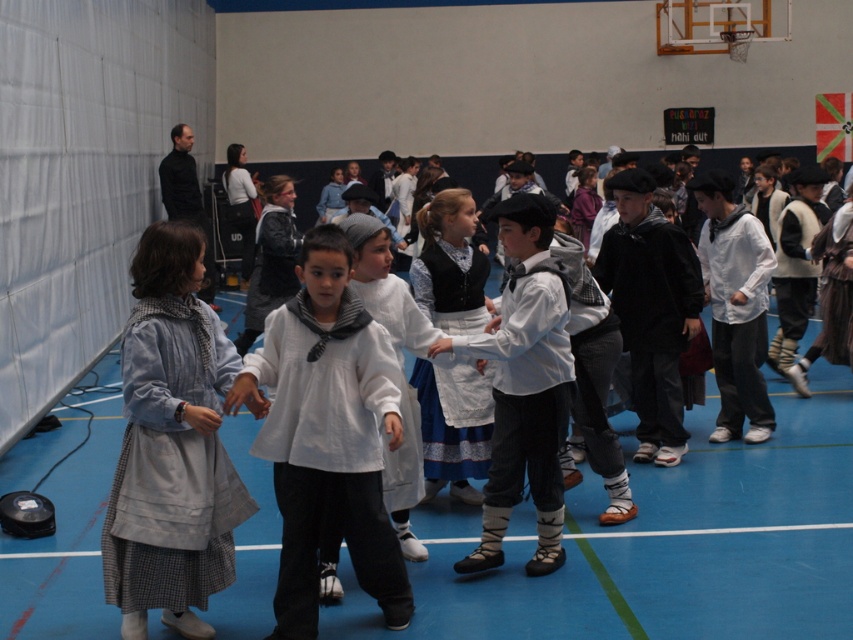
You are a photographer in the gymnasium and want to capture both the white matte shirt at center and the white cotton shirt at center in a single photo. Which shirt should you focus on first to ensure both are in frame?

The white matte shirt at center has a lesser height compared to the white cotton shirt at center, so you should focus on the white cotton shirt at center first to ensure both are in frame.

You are a photographer setting up for a group photo in the gymnasium. You need to ensure that the denim jacket at left and the white cotton shirt at center are both visible in the frame. Based on their heights, which clothing item should you focus on to ensure both are in the shot?

The denim jacket at left is shorter than the white cotton shirt at center. To ensure both are visible, focus on the white cotton shirt at center as it is taller, allowing the shorter denim jacket at left to still be in the frame.

You are organizing a group photo and need to arrange the children in a line. The denim jacket at left and the white cotton shirt at center are two participants. If you want to place them side by side, which one should be positioned on the left to ensure there is enough space between them?

The denim jacket at left should be placed on the left side because it is wider than the white cotton shirt at center, allowing more space between them when positioned side by side.